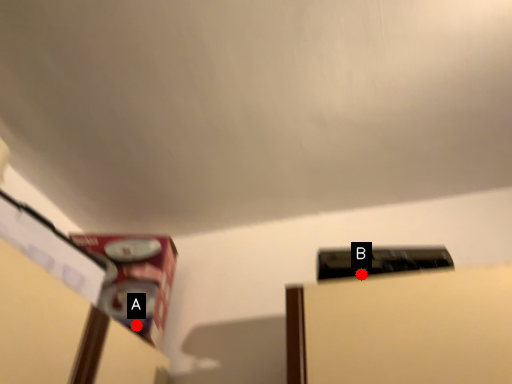
Question: Two points are circled on the image, labeled by A and B beside each circle. Which of the following is the closest to the observer?

Choices:
 (A) A is closer
 (B) B is closer

Answer: (B)